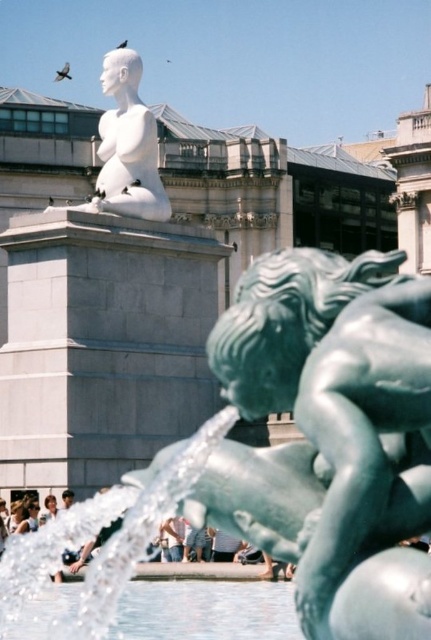
You are a photographer planning to capture the white marble statue at upper center and the clear water at fountain center in a single shot. Given that the statue is larger than the water feature, how should you position your camera to ensure both are visible without cropping?

Since the clear water at fountain center is smaller than the white marble statue at upper center, you should position your camera closer to the clear water at fountain center to balance their sizes in the frame.